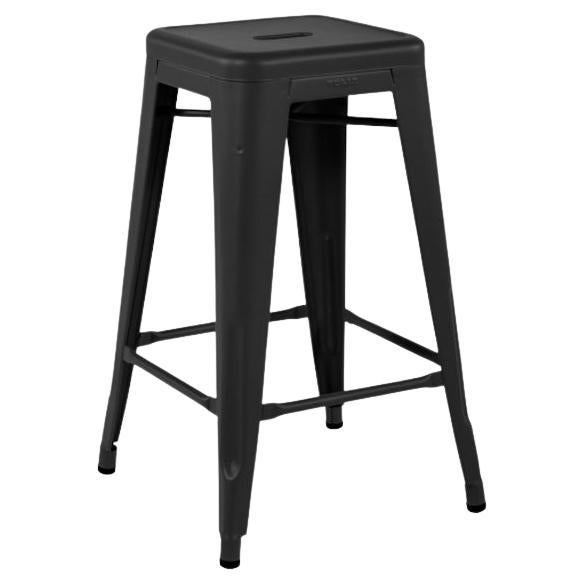
I want to click on round shaped feet of stool, so click(479, 510), click(335, 425), click(232, 565), click(105, 470).